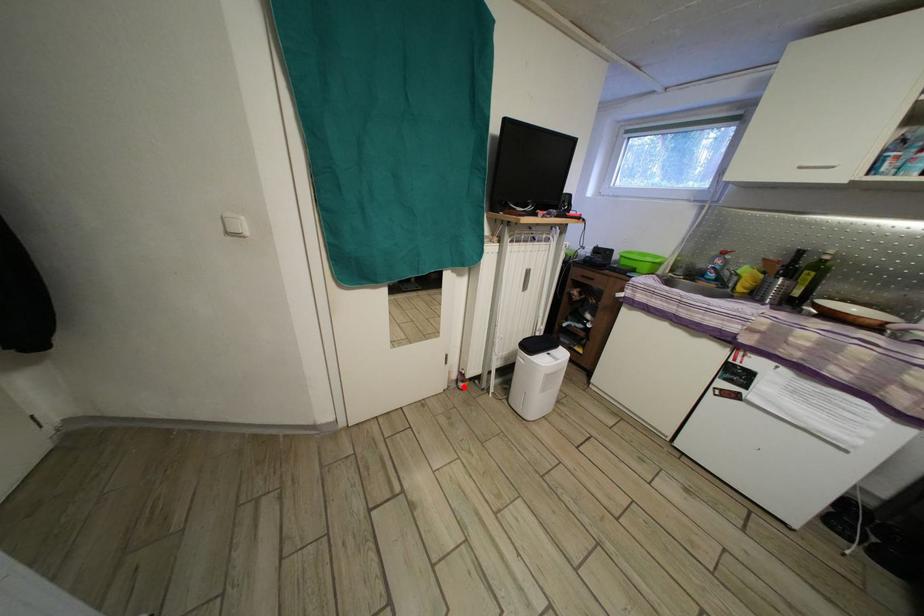
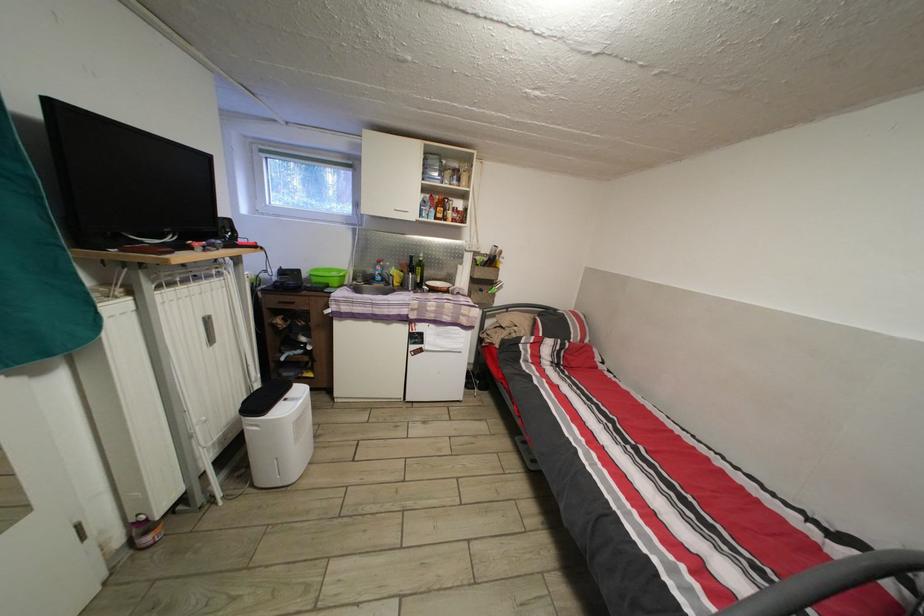
Find the pixel in the second image that matches the highlighted location in the first image.

(138, 548)